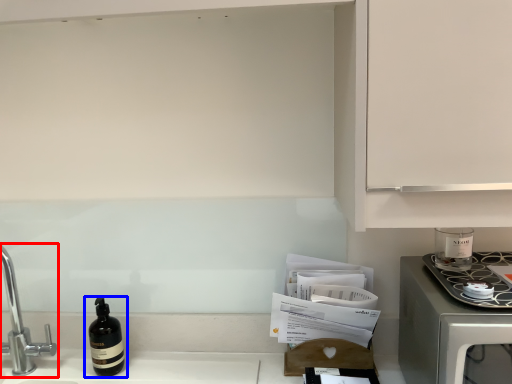
Question: Which point is further to the camera, tap (highlighted by a red box) or bottle (highlighted by a blue box)?

Choices:
 (A) tap
 (B) bottle

Answer: (B)